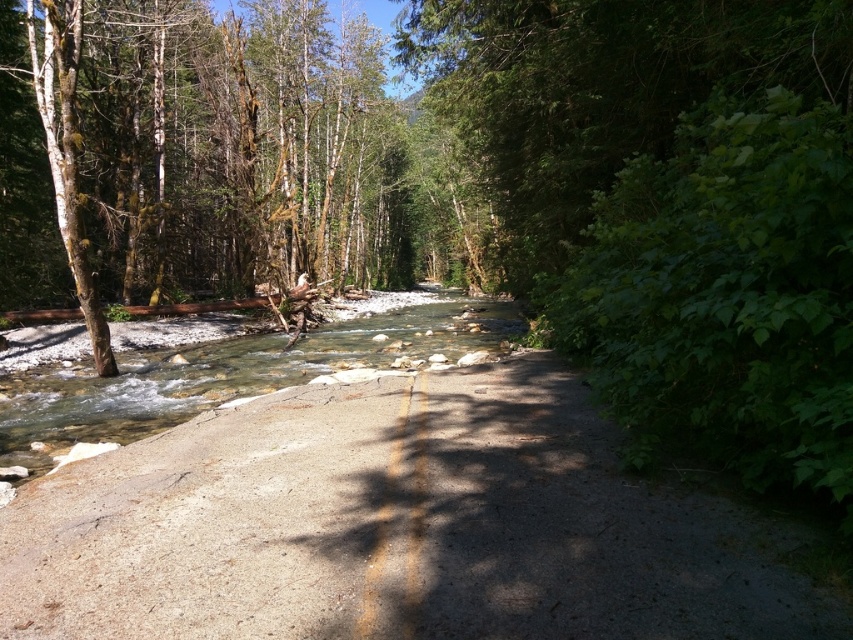
From the picture: You are a hiker standing on the road and want to cross to the other side. Which direction should you walk to reach the green mossy tree at left before the clear water at center?

You should walk to the left because the green mossy tree at left is to the left of clear water at center, so you can reach it first by moving in that direction.

You are standing at the point marked by the coordinates point (196, 141). Which direction should you walk to reach the road?

The point (196, 141) corresponds to the green mossy tree at left, which is located on the left side of the road. To reach the road, you should walk towards the right.

You are a hiker planning to cross the stream using the gray concrete road at center and the clear water at center. Which path is shorter in length?

The gray concrete road at center is shorter than clear water at center, so the road is the shorter path.